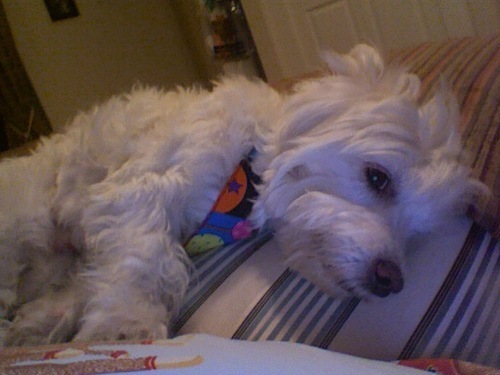
Locate an element on the screen. The image size is (500, 375). colorful fabric is located at coordinates click(x=234, y=208).